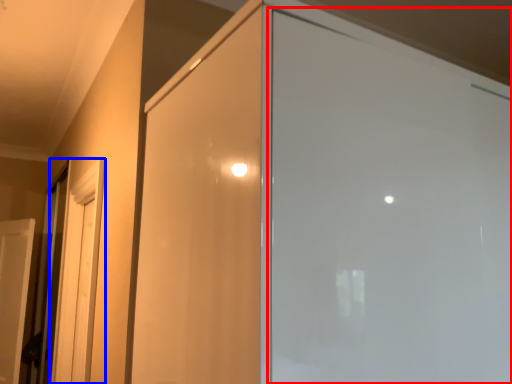
Question: Which object is closer to the camera taking this photo, screen door (highlighted by a red box) or screen door (highlighted by a blue box)?

Choices:
 (A) screen door
 (B) screen door

Answer: (A)